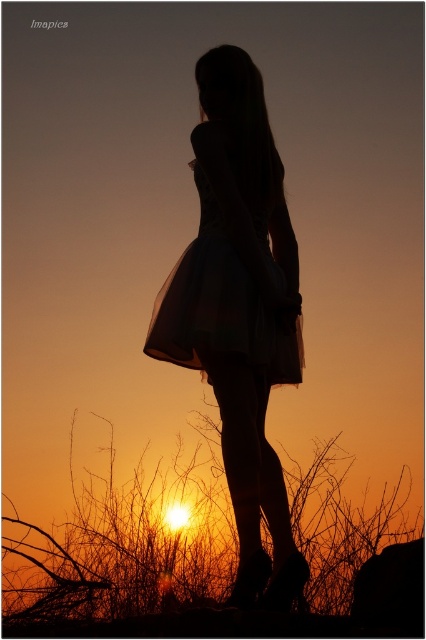
You are a fashion designer trying to create a layered look using both the silhouette dress at center and the translucent tulle dress at center. Given that the two dresses are positioned very close to each other, do you think layering them would create a cohesive visual effect?

The silhouette dress at center is 10.70 centimeters from the translucent tulle dress at center, which means they are positioned close enough to layer seamlessly, creating a cohesive and elegant visual effect when combined.

You are a fashion designer who wants to create a layered look using both the silhouette dress at center and the translucent tulle dress at center. Which dress should you place on top to ensure the larger one is visible?

The silhouette dress at center is larger than the translucent tulle dress at center, so you should place the translucent tulle dress at center on top to allow the larger silhouette dress at center to be visible underneath.

You are a fashion designer analyzing the image. You need to determine which dress is narrower between the silhouette dress at center and the translucent tulle dress at center. Which one is it?

The silhouette dress at center has a lesser width compared to the translucent tulle dress at center, so the silhouette dress at center is narrower.